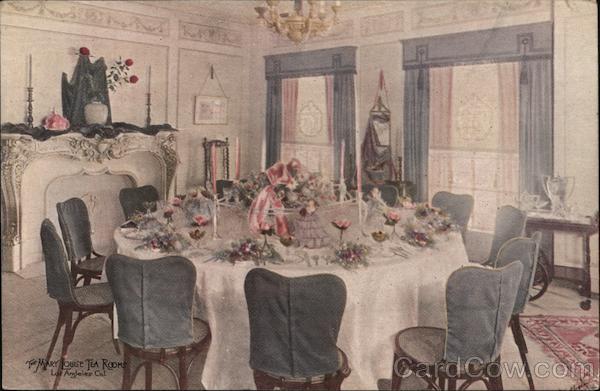
Locate an element on the screen. The image size is (600, 391). urn is located at coordinates (556, 187).